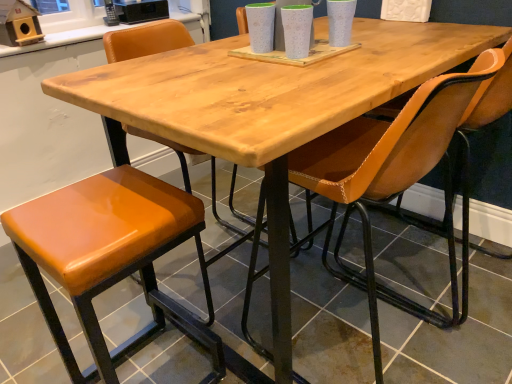
Question: Considering the relative positions of orange leather chair at center, acting as the second chair starting from the bottom, and leatherette chair at center, which is counted as the 1th chair, starting from the bottom, in the image provided, is orange leather chair at center, acting as the second chair starting from the bottom, to the left of leatherette chair at center, which is counted as the 1th chair, starting from the bottom, from the viewer's perspective?

Choices:
 (A) yes
 (B) no

Answer: (A)

Question: Can you confirm if orange leather chair at center, positioned as the first chair in top-to-bottom order, is shorter than leatherette chair at center, which is counted as the 1th chair, starting from the bottom?

Choices:
 (A) no
 (B) yes

Answer: (B)

Question: Would you consider orange leather chair at center, positioned as the first chair in top-to-bottom order, to be distant from leatherette chair at center, which ranks as the first chair in front-to-back order?

Choices:
 (A) no
 (B) yes

Answer: (A)

Question: Does orange leather chair at center, acting as the second chair starting from the bottom, come in front of leatherette chair at center, which is counted as the 1th chair, starting from the bottom?

Choices:
 (A) yes
 (B) no

Answer: (B)

Question: Is leatherette chair at center, which is the 2th chair in back-to-front order, located within orange leather chair at center, positioned as the first chair in top-to-bottom order?

Choices:
 (A) no
 (B) yes

Answer: (A)

Question: Considering the positions of leatherette chair at center, which is counted as the 1th chair, starting from the bottom, and orange leather stool at lower left in the image, is leatherette chair at center, which is counted as the 1th chair, starting from the bottom, wider or thinner than orange leather stool at lower left?

Choices:
 (A) wide
 (B) thin

Answer: (A)

Question: Is leatherette chair at center, which is counted as the 1th chair, starting from the bottom, to the left or to the right of orange leather stool at lower left in the image?

Choices:
 (A) right
 (B) left

Answer: (A)

Question: In the image, is leatherette chair at center, which ranks as the first chair in front-to-back order, positioned in front of or behind orange leather stool at lower left?

Choices:
 (A) front
 (B) behind

Answer: (A)

Question: Would you say leatherette chair at center, the 2th chair positioned from the top, is inside or outside orange leather stool at lower left?

Choices:
 (A) inside
 (B) outside

Answer: (B)

Question: Is point (411, 96) positioned closer to the camera than point (240, 14)?

Choices:
 (A) closer
 (B) farther

Answer: (A)

Question: Based on their sizes in the image, would you say leatherette chair at center, the 2th chair positioned from the top, is bigger or smaller than orange leather chair at center, acting as the second chair starting from the bottom?

Choices:
 (A) big
 (B) small

Answer: (A)

Question: Is leatherette chair at center, which is the 2th chair in back-to-front order, to the left or to the right of orange leather chair at center, which is counted as the 2th chair, starting from the front, in the image?

Choices:
 (A) right
 (B) left

Answer: (A)

Question: Considering their positions, is leatherette chair at center, which ranks as the first chair in front-to-back order, located in front of or behind orange leather chair at center, positioned as the first chair in top-to-bottom order?

Choices:
 (A) front
 (B) behind

Answer: (A)

Question: Is orange leather chair at center, acting as the second chair starting from the bottom, spatially inside leatherette chair at center, the 2th chair positioned from the top, or outside of it?

Choices:
 (A) outside
 (B) inside

Answer: (A)

Question: From a real-world perspective, is orange leather chair at center, arranged as the 1th chair when viewed from the back, above or below leatherette chair at center, which is counted as the 1th chair, starting from the bottom?

Choices:
 (A) above
 (B) below

Answer: (A)